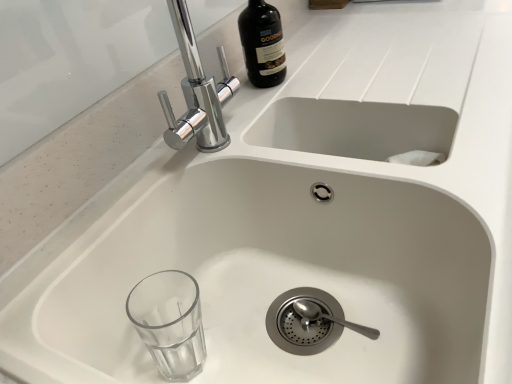
The image size is (512, 384). What are the coordinates of `vacant space behind dark brown glass bottle at upper center` in the screenshot? It's located at (300, 39).